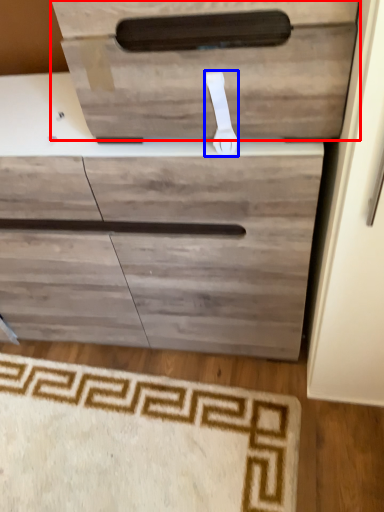
Question: Among these objects, which one is nearest to the camera, drawer (highlighted by a red box) or door handle (highlighted by a blue box)?

Choices:
 (A) drawer
 (B) door handle

Answer: (A)